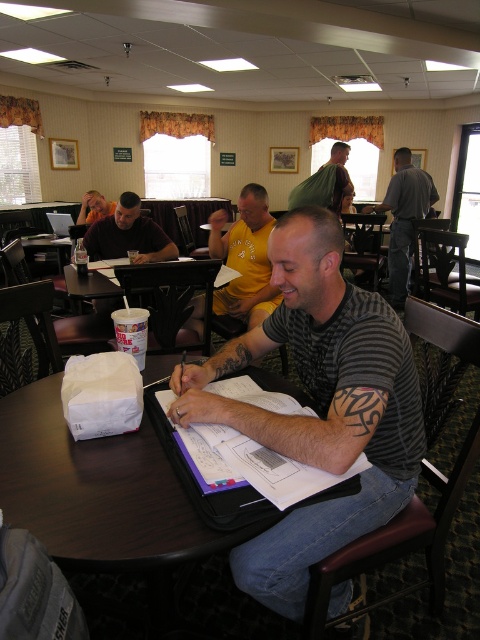
Is white paper cup at center positioned at the back of matte black laptop at upper left?

No, it is not.

Between white paper cup at center and matte black laptop at upper left, which one is positioned higher?

matte black laptop at upper left is higher up.

At what (x,y) coordinates should I click in order to perform the action: click on white paper cup at center. Please return your answer as a coordinate pair (x, y). This screenshot has height=640, width=480. Looking at the image, I should click on (145, 280).

Which is in front, point (336, 352) or point (321, 184)?

Positioned in front is point (336, 352).

Is gray striped shirt at center shorter than green fabric shirt at upper center?

In fact, gray striped shirt at center may be taller than green fabric shirt at upper center.

The image size is (480, 640). What are the coordinates of `gray striped shirt at center` in the screenshot? It's located at (319, 404).

The height and width of the screenshot is (640, 480). I want to click on gray striped shirt at center, so click(x=319, y=404).

Which of these two, gray striped shirt at center or matte black laptop at upper left, stands taller?

With more height is gray striped shirt at center.

Is point (284, 570) more distant than point (90, 209)?

No, (284, 570) is closer to viewer.

I want to click on gray striped shirt at center, so click(x=319, y=404).